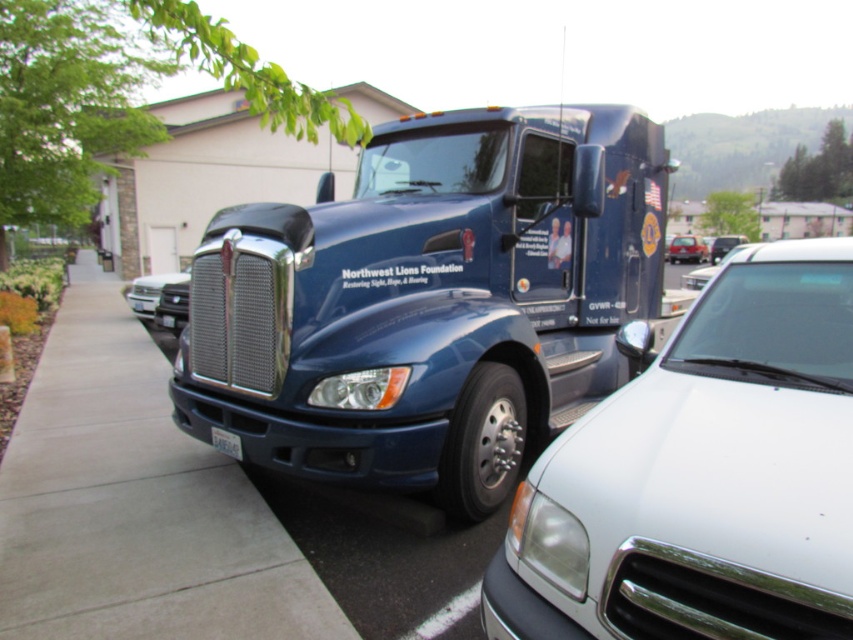
Question: Among these points, which one is nearest to the camera?

Choices:
 (A) (830, 582)
 (B) (689, 241)

Answer: (A)

Question: Among these objects, which one is nearest to the camera?

Choices:
 (A) glossy blue trailer truck at center
 (B) white plastic license plate at lower center
 (C) matte black truck at center

Answer: (A)

Question: Is white glossy car at center bigger than concrete at center?

Choices:
 (A) no
 (B) yes

Answer: (A)

Question: Does white glossy car at center appear under concrete at center?

Choices:
 (A) yes
 (B) no

Answer: (B)

Question: Is glossy blue trailer truck at center above concrete at center?

Choices:
 (A) yes
 (B) no

Answer: (A)

Question: Among these objects, which one is farthest from the camera?

Choices:
 (A) white glossy car at center
 (B) white plastic license plate at lower center
 (C) matte black truck at center
 (D) glossy blue trailer truck at center

Answer: (C)